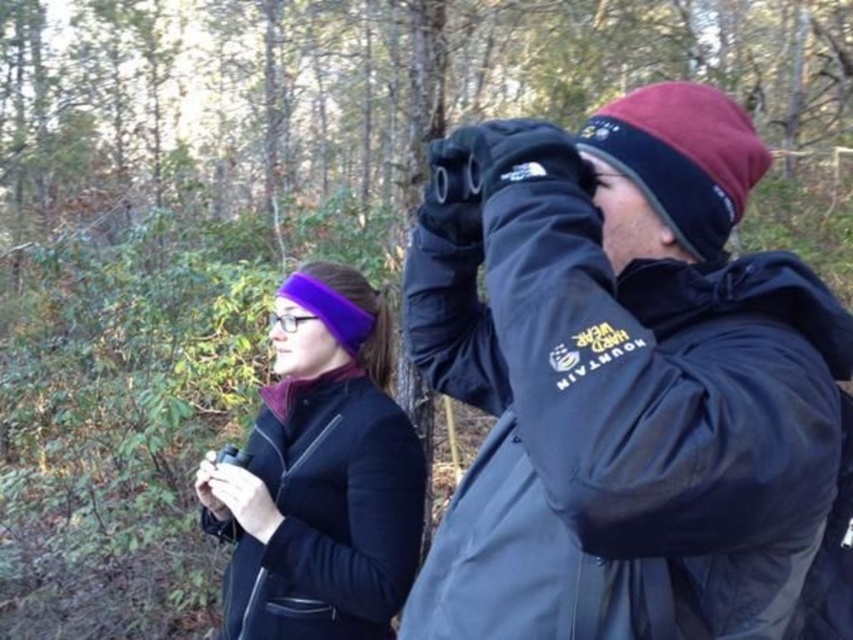
Consider the image. Is matte black jacket at center positioned behind purple fleece headband at center?

No, matte black jacket at center is closer to the viewer.

Who is positioned more to the left, matte black jacket at center or purple fleece headband at center?

Positioned to the left is purple fleece headband at center.

The image size is (853, 640). Describe the element at coordinates (622, 380) in the screenshot. I see `matte black jacket at center` at that location.

This screenshot has width=853, height=640. I want to click on matte black jacket at center, so click(622, 380).